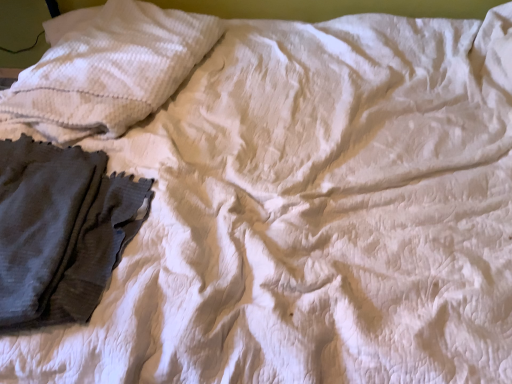
Question: Is white textured pillow at upper left spatially inside dark gray textured fabric at left, or outside of it?

Choices:
 (A) inside
 (B) outside

Answer: (B)

Question: Is white textured pillow at upper left in front of or behind dark gray textured fabric at left in the image?

Choices:
 (A) front
 (B) behind

Answer: (B)

Question: Does point (146, 69) appear closer or farther from the camera than point (38, 233)?

Choices:
 (A) farther
 (B) closer

Answer: (A)

Question: Does point 77,279 appear closer or farther from the camera than point 113,9?

Choices:
 (A) closer
 (B) farther

Answer: (A)

Question: Considering the positions of dark gray textured fabric at left and white textured pillow at upper left in the image, is dark gray textured fabric at left bigger or smaller than white textured pillow at upper left?

Choices:
 (A) small
 (B) big

Answer: (A)

Question: Is dark gray textured fabric at left to the left or to the right of white textured pillow at upper left in the image?

Choices:
 (A) right
 (B) left

Answer: (B)

Question: Considering the positions of dark gray textured fabric at left and white textured pillow at upper left in the image, is dark gray textured fabric at left taller or shorter than white textured pillow at upper left?

Choices:
 (A) short
 (B) tall

Answer: (A)